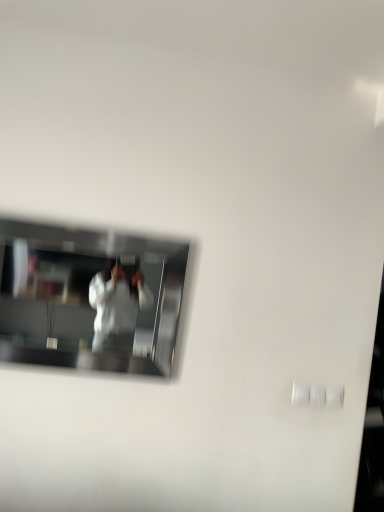
Measure the distance between metallic silver mirror at left and camera.

They are 3.14 meters apart.

Where is `metallic silver mirror at left`? The width and height of the screenshot is (384, 512). metallic silver mirror at left is located at coordinates (90, 298).

What do you see at coordinates (90, 298) in the screenshot? I see `metallic silver mirror at left` at bounding box center [90, 298].

I want to click on metallic silver mirror at left, so click(x=90, y=298).